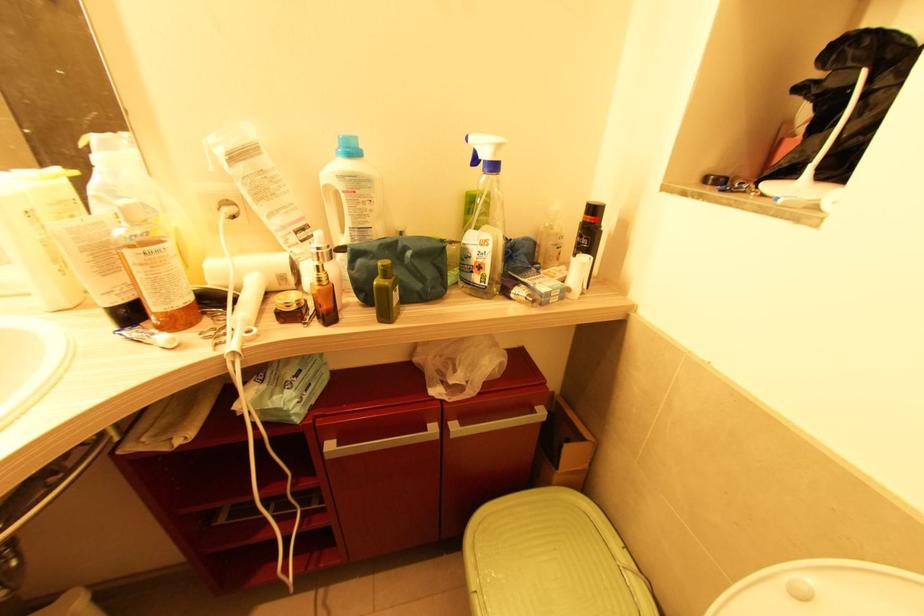
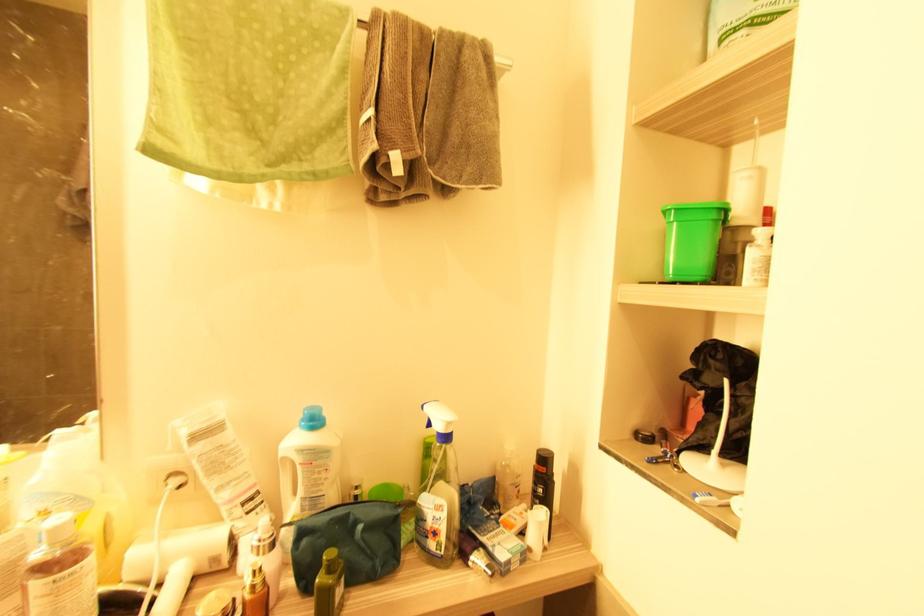
Locate, in the second image, the point that corresponds to the highlighted location in the first image.

(545, 469)